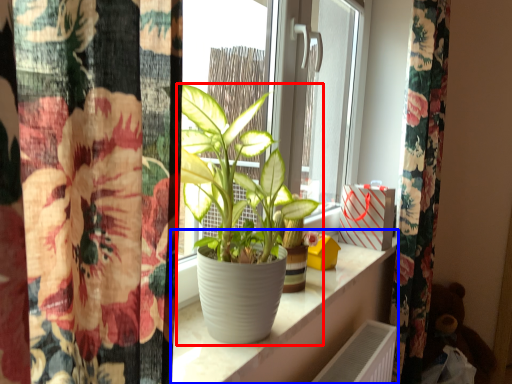
Question: Among these objects, which one is farthest to the camera, houseplant (highlighted by a red box) or window sill (highlighted by a blue box)?

Choices:
 (A) houseplant
 (B) window sill

Answer: (B)